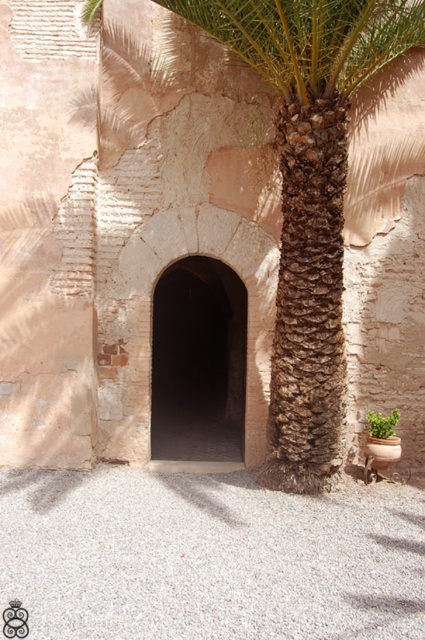
Can you confirm if brown textured palm tree at center is positioned below green leafy plant at lower right?

No.

Is point (294, 99) positioned in front of point (387, 432)?

That is True.

I want to click on brown textured palm tree at center, so click(263, 202).

Between brown textured palm tree at center and dark stone arch at center, which one has less height?

dark stone arch at center is shorter.

Is brown textured palm tree at center smaller than dark stone arch at center?

Correct, brown textured palm tree at center occupies less space than dark stone arch at center.

The width and height of the screenshot is (425, 640). Describe the element at coordinates (263, 202) in the screenshot. I see `brown textured palm tree at center` at that location.

At what (x,y) coordinates should I click in order to perform the action: click on brown textured palm tree at center. Please return your answer as a coordinate pair (x, y). The image size is (425, 640). Looking at the image, I should click on (263, 202).

Consider the image. Which is above, dark stone arch at center or green leafy plant at lower right?

dark stone arch at center

Is dark stone arch at center wider than green leafy plant at lower right?

Correct, the width of dark stone arch at center exceeds that of green leafy plant at lower right.

Who is more forward, (180, 276) or (387, 429)?

Point (387, 429) is in front.

Identify the location of dark stone arch at center. coord(198,362).